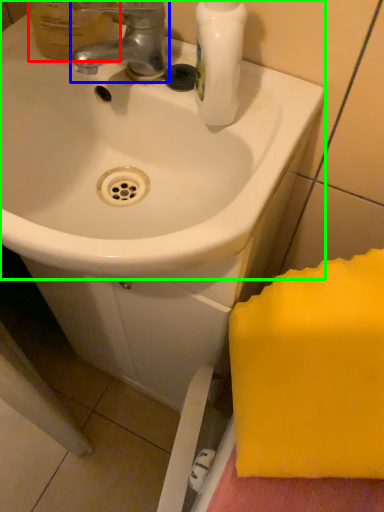
Question: Which object is positioned closest to mouthwash (highlighted by a red box)? Select from tap (highlighted by a blue box) and sink (highlighted by a green box).

Choices:
 (A) tap
 (B) sink

Answer: (A)